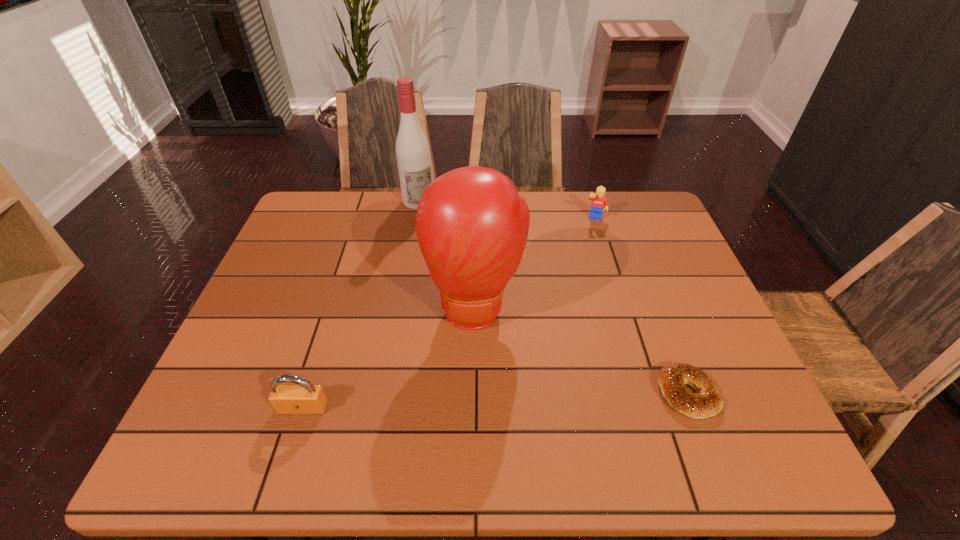
Locate an element on the screen. The image size is (960, 540). vacant space at the far right corner is located at coordinates (611, 212).

Identify the location of vacant region at the near right corner of the desktop. (737, 391).

Where is `empty space between the leftmost object and the alcohol`? The width and height of the screenshot is (960, 540). empty space between the leftmost object and the alcohol is located at coordinates (361, 304).

The height and width of the screenshot is (540, 960). I want to click on free area in between the bagel and the third object from left to right, so click(x=582, y=351).

The height and width of the screenshot is (540, 960). What are the coordinates of `unoccupied position between the shortest object and the third nearest object` in the screenshot? It's located at (582, 351).

Identify the location of blank region between the leftmost object and the third object from left to right. This screenshot has height=540, width=960. [390, 358].

Identify the location of free space between the padlock and the shortest object. This screenshot has width=960, height=540. (494, 400).

Identify the location of vacant area that lies between the Lego and the boxing glove. (536, 264).

Identify the location of free space between the shortest object and the alcohol. (553, 297).

Where is `free space between the boxing glove and the bagel`? The image size is (960, 540). free space between the boxing glove and the bagel is located at coordinates (582, 351).